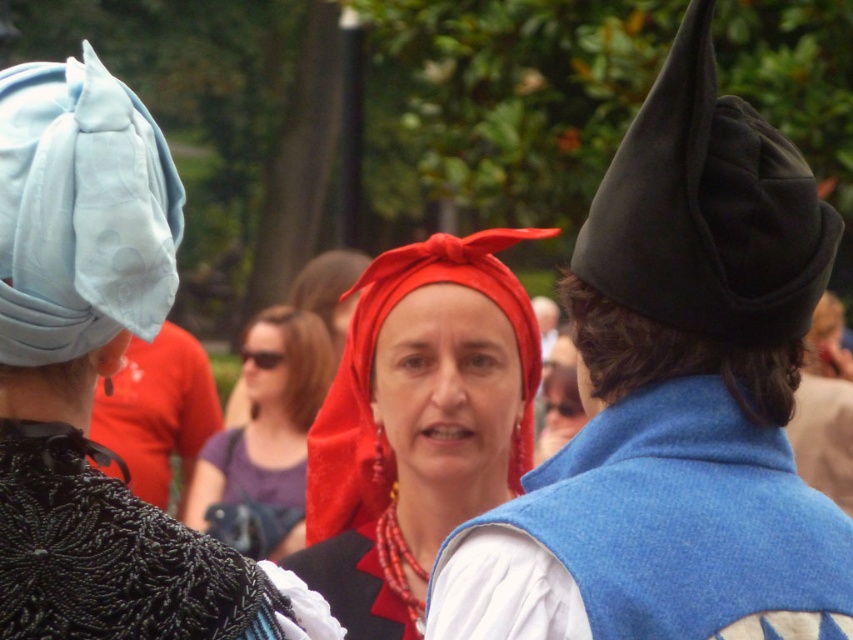
Is point (32, 408) positioned before point (320, 321)?

Yes.

Between point (38, 132) and point (247, 484), which one is positioned behind?

The point (247, 484) is behind.

Locate an element on the screen. The height and width of the screenshot is (640, 853). matte blue fabric hat at upper left is located at coordinates (96, 378).

Can you confirm if velvet black hat at center is shorter than matte red fabric headscarf at center?

Indeed, velvet black hat at center has a lesser height compared to matte red fabric headscarf at center.

Is point (782, 515) closer to viewer compared to point (376, 429)?

That is True.

Find the location of `velvet black hat at center`. velvet black hat at center is located at coordinates (675, 401).

Can you confirm if matte red headscarf at center is positioned to the right of matte black hat at left?

Correct, you'll find matte red headscarf at center to the right of matte black hat at left.

Between matte red headscarf at center and matte black hat at left, which one appears on the left side from the viewer's perspective?

matte black hat at left is more to the left.

The width and height of the screenshot is (853, 640). I want to click on matte red headscarf at center, so click(267, 417).